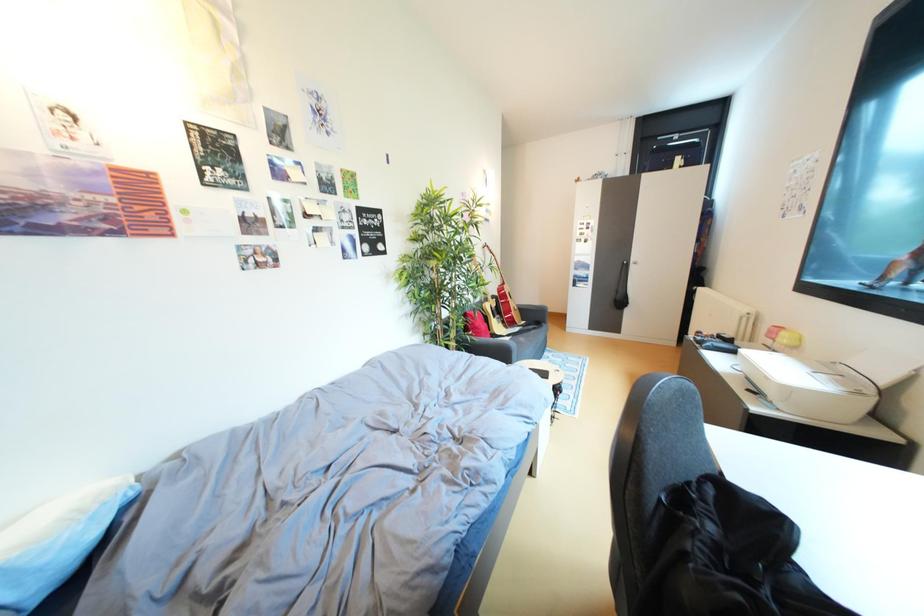
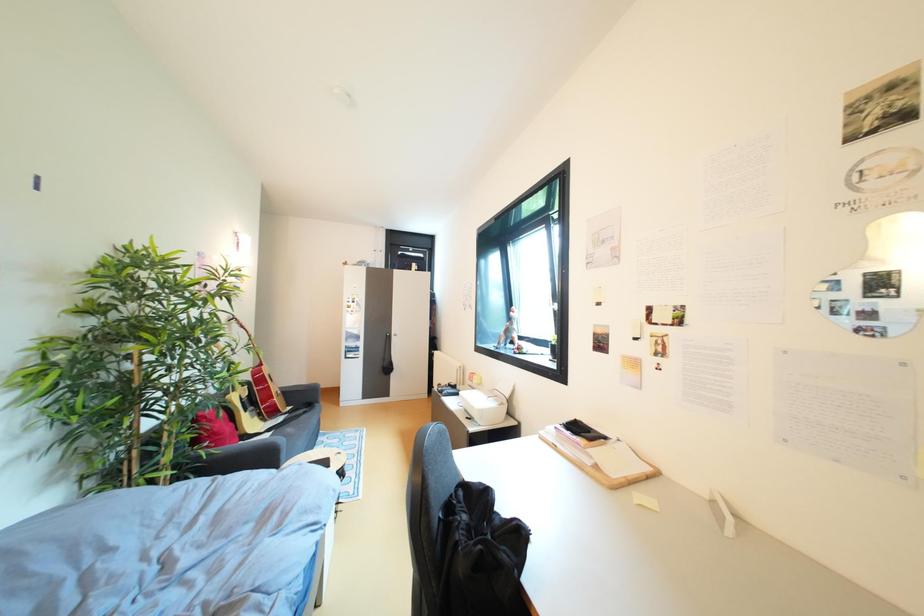
Question: The images are taken continuously from a first-person perspective. In which direction is your viewpoint rotating?

Choices:
 (A) Left
 (B) Right
 (C) Up
 (D) Down

Answer: (B)